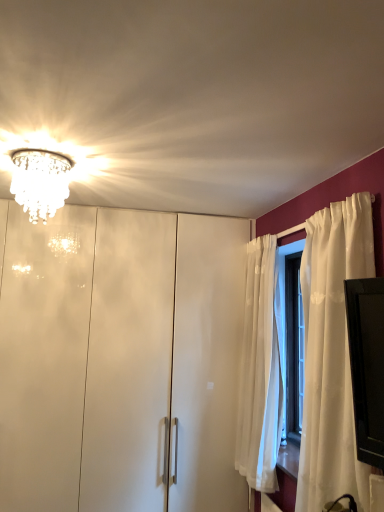
Identify the location of crystal glass chandelier at upper left. (40, 182).

Image resolution: width=384 pixels, height=512 pixels. What do you see at coordinates (40, 182) in the screenshot? I see `crystal glass chandelier at upper left` at bounding box center [40, 182].

Find the location of a particular element. glossy white dresser at center is located at coordinates (85, 359).

Describe the element at coordinates (85, 359) in the screenshot. This screenshot has height=512, width=384. I see `glossy white dresser at center` at that location.

The width and height of the screenshot is (384, 512). Identify the location of crystal glass chandelier at upper left. (40, 182).

Which is more to the right, crystal glass chandelier at upper left or glossy white dresser at center?

Positioned to the right is glossy white dresser at center.

Considering the positions of objects crystal glass chandelier at upper left and glossy white dresser at center in the image provided, who is behind, crystal glass chandelier at upper left or glossy white dresser at center?

glossy white dresser at center is further from the camera.

Does point (36, 190) come in front of point (40, 251)?

Yes.

From the image's perspective, is crystal glass chandelier at upper left positioned above or below glossy white dresser at center?

From the image's perspective, crystal glass chandelier at upper left appears above glossy white dresser at center.

From a real-world perspective, is crystal glass chandelier at upper left under glossy white dresser at center?

No, from a real-world perspective, crystal glass chandelier at upper left is not under glossy white dresser at center.

Does crystal glass chandelier at upper left have a greater width compared to glossy white dresser at center?

No, crystal glass chandelier at upper left is not wider than glossy white dresser at center.

Considering the sizes of crystal glass chandelier at upper left and glossy white dresser at center in the image, is crystal glass chandelier at upper left taller or shorter than glossy white dresser at center?

crystal glass chandelier at upper left is shorter than glossy white dresser at center.

Can you confirm if crystal glass chandelier at upper left is smaller than glossy white dresser at center?

Indeed, crystal glass chandelier at upper left has a smaller size compared to glossy white dresser at center.

Is crystal glass chandelier at upper left located outside glossy white dresser at center?

Yes, crystal glass chandelier at upper left is located beyond the bounds of glossy white dresser at center.

Is crystal glass chandelier at upper left far from glossy white dresser at center?

crystal glass chandelier at upper left is far away from glossy white dresser at center.

Is crystal glass chandelier at upper left positioned with its back to glossy white dresser at center?

Absolutely, crystal glass chandelier at upper left is directed away from glossy white dresser at center.

What's the angular difference between crystal glass chandelier at upper left and glossy white dresser at center's facing directions?

The angle between the facing direction of crystal glass chandelier at upper left and the facing direction of glossy white dresser at center is 3.53 degrees.

How much distance is there between crystal glass chandelier at upper left and glossy white dresser at center?

crystal glass chandelier at upper left is 3.48 feet away from glossy white dresser at center.

Where is `lamp on the left of glossy white dresser at center`? lamp on the left of glossy white dresser at center is located at coordinates (40, 182).

Is glossy white dresser at center at the left side of crystal glass chandelier at upper left?

No.

Who is more distant, glossy white dresser at center or crystal glass chandelier at upper left?

glossy white dresser at center is behind.

Considering the positions of points (228, 241) and (16, 163), is point (228, 241) farther from camera compared to point (16, 163)?

Yes, point (228, 241) is farther from viewer.

From the image's perspective, relative to crystal glass chandelier at upper left, is glossy white dresser at center above or below?

Clearly, from the image's perspective, glossy white dresser at center is below crystal glass chandelier at upper left.

From a real-world perspective, is glossy white dresser at center over crystal glass chandelier at upper left?

Actually, glossy white dresser at center is physically below crystal glass chandelier at upper left in the real world.

Is glossy white dresser at center wider than crystal glass chandelier at upper left?

Correct, the width of glossy white dresser at center exceeds that of crystal glass chandelier at upper left.

Looking at this image, considering the relative sizes of glossy white dresser at center and crystal glass chandelier at upper left in the image provided, is glossy white dresser at center taller than crystal glass chandelier at upper left?

Yes, glossy white dresser at center is taller than crystal glass chandelier at upper left.

Who is smaller, glossy white dresser at center or crystal glass chandelier at upper left?

crystal glass chandelier at upper left.

Is crystal glass chandelier at upper left located within glossy white dresser at center?

Actually, crystal glass chandelier at upper left is outside glossy white dresser at center.

Are glossy white dresser at center and crystal glass chandelier at upper left beside each other?

There is a gap between glossy white dresser at center and crystal glass chandelier at upper left.

Is glossy white dresser at center turned away from crystal glass chandelier at upper left?

glossy white dresser at center is not turned away from crystal glass chandelier at upper left.

How different are the orientations of glossy white dresser at center and crystal glass chandelier at upper left in degrees?

glossy white dresser at center and crystal glass chandelier at upper left are facing 3.53 degrees away from each other.

You are a GUI agent. You are given a task and a screenshot of the screen. Output one action in this format:
    pyautogui.click(x=<x>, y=<y>)
    Task: Click on the dresser below the crystal glass chandelier at upper left (from a real-world perspective)
    The width and height of the screenshot is (384, 512).
    Given the screenshot: What is the action you would take?
    pyautogui.click(x=85, y=359)

What are the coordinates of `lamp that is on the left side of glossy white dresser at center` in the screenshot? It's located at [x=40, y=182].

You are a GUI agent. You are given a task and a screenshot of the screen. Output one action in this format:
    pyautogui.click(x=<x>, y=<y>)
    Task: Click on the dresser located underneath the crystal glass chandelier at upper left (from a real-world perspective)
    
    Given the screenshot: What is the action you would take?
    pyautogui.click(x=85, y=359)